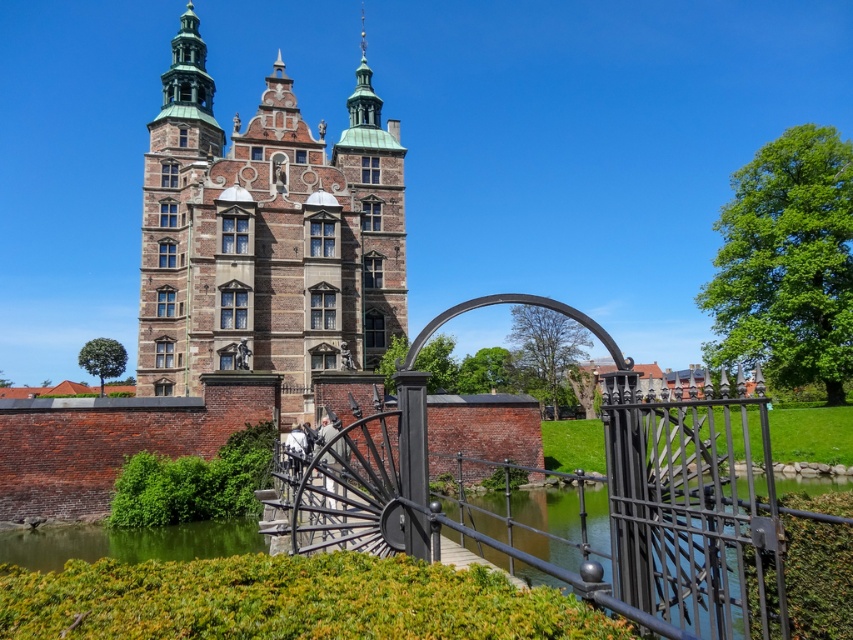
Can you confirm if black wrought iron gate at center is shorter than green water at lower left?

Incorrect, black wrought iron gate at center's height does not fall short of green water at lower left's.

The height and width of the screenshot is (640, 853). Find the location of `black wrought iron gate at center`. black wrought iron gate at center is located at coordinates (607, 502).

Is brown brick church at upper left positioned behind black wrought iron gate at center?

That is True.

Who is positioned more to the right, brown brick church at upper left or black wrought iron gate at center?

Positioned to the right is black wrought iron gate at center.

Locate an element on the screen. brown brick church at upper left is located at coordinates (265, 236).

Between brown brick church at upper left and green water at lower left, which one is positioned higher?

brown brick church at upper left

Between brown brick church at upper left and green water at lower left, which one appears on the left side from the viewer's perspective?

From the viewer's perspective, green water at lower left appears more on the left side.

Who is more distant from viewer, (340, 161) or (39, 538)?

Point (340, 161)

I want to click on brown brick church at upper left, so click(x=265, y=236).